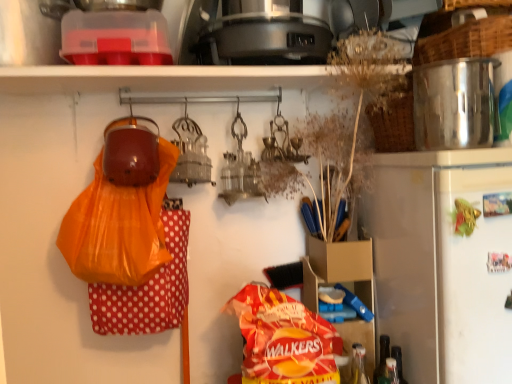
Question: Considering the relative sizes of red matte bag of walkers chips at center and satin silver refrigerator at right in the image provided, is red matte bag of walkers chips at center thinner than satin silver refrigerator at right?

Choices:
 (A) no
 (B) yes

Answer: (B)

Question: Is red matte bag of walkers chips at center outside satin silver refrigerator at right?

Choices:
 (A) no
 (B) yes

Answer: (B)

Question: Is red matte bag of walkers chips at center in contact with satin silver refrigerator at right?

Choices:
 (A) yes
 (B) no

Answer: (B)

Question: Is red matte bag of walkers chips at center oriented away from satin silver refrigerator at right?

Choices:
 (A) no
 (B) yes

Answer: (A)

Question: Is red matte bag of walkers chips at center at the right side of satin silver refrigerator at right?

Choices:
 (A) no
 (B) yes

Answer: (A)

Question: Is point (509, 48) closer or farther from the camera than point (385, 342)?

Choices:
 (A) closer
 (B) farther

Answer: (A)

Question: In terms of width, does silver metallic pot at upper right look wider or thinner when compared to translucent plastic bottle at lower right, acting as the second bottle starting from the left?

Choices:
 (A) wide
 (B) thin

Answer: (A)

Question: From a real-world perspective, is silver metallic pot at upper right physically located above or below translucent plastic bottle at lower right, acting as the second bottle starting from the left?

Choices:
 (A) above
 (B) below

Answer: (A)

Question: Considering the positions of silver metallic pot at upper right and translucent plastic bottle at lower right, the first bottle when ordered from right to left, in the image, is silver metallic pot at upper right taller or shorter than translucent plastic bottle at lower right, the first bottle when ordered from right to left,?

Choices:
 (A) tall
 (B) short

Answer: (B)

Question: In terms of size, does shiny metallic pot at upper right appear bigger or smaller than satin silver refrigerator at right?

Choices:
 (A) big
 (B) small

Answer: (B)

Question: From a real-world perspective, is shiny metallic pot at upper right physically located above or below satin silver refrigerator at right?

Choices:
 (A) above
 (B) below

Answer: (A)

Question: Is point (424, 102) positioned closer to the camera than point (439, 339)?

Choices:
 (A) closer
 (B) farther

Answer: (B)

Question: From the image's perspective, is shiny metallic pot at upper right above or below satin silver refrigerator at right?

Choices:
 (A) above
 (B) below

Answer: (A)

Question: Considering their positions, is satin silver refrigerator at right located in front of or behind shiny metallic pot at upper right?

Choices:
 (A) front
 (B) behind

Answer: (B)

Question: Is satin silver refrigerator at right spatially inside shiny metallic pot at upper right, or outside of it?

Choices:
 (A) inside
 (B) outside

Answer: (B)